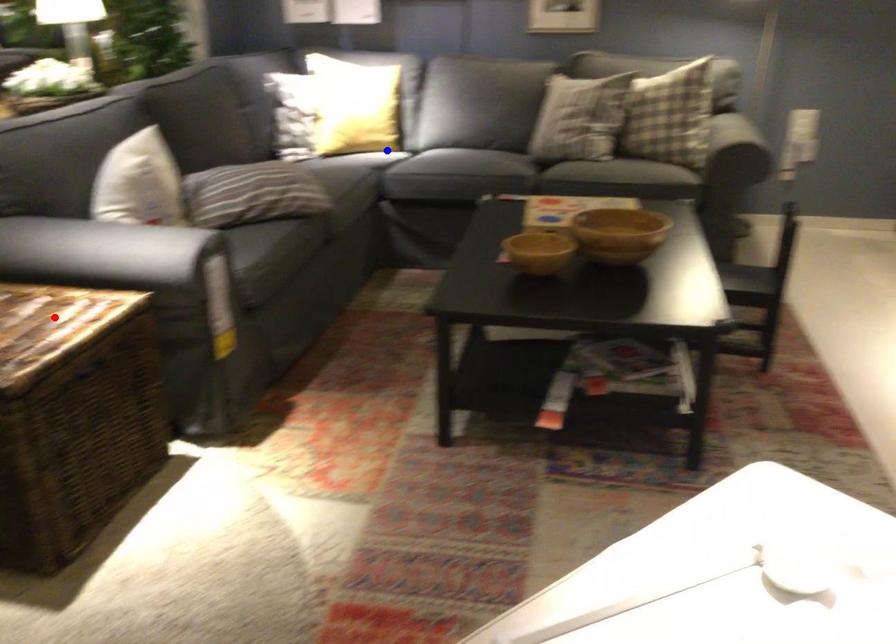
Question: Two points are marked on the image. Which point is closer to the camera?

Choices:
 (A) Blue point is closer.
 (B) Red point is closer.

Answer: (B)